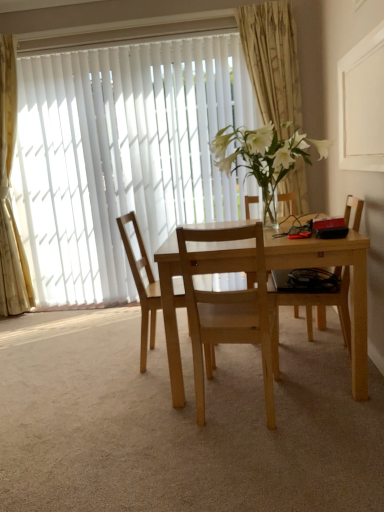
Find the location of a particular element. free space to the left of light wood table at center is located at coordinates (90, 401).